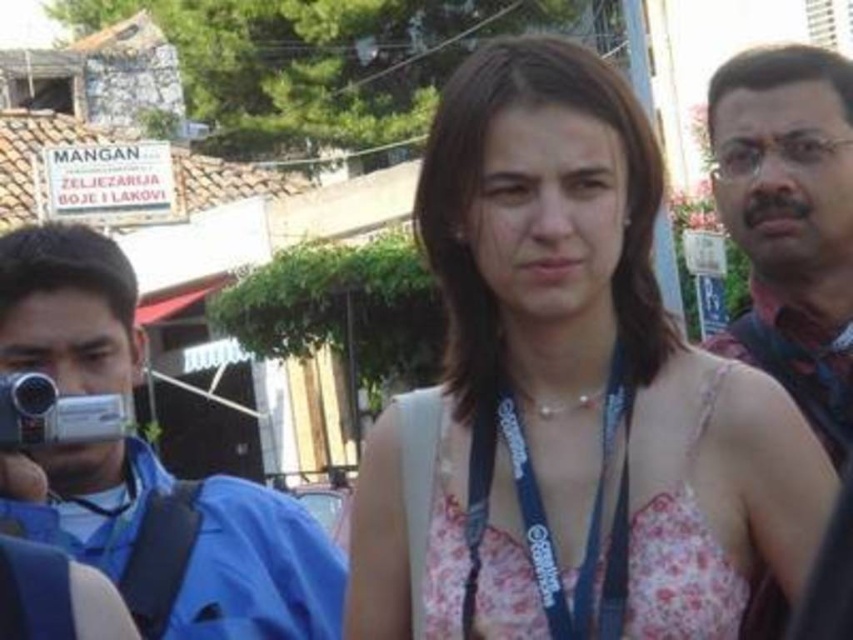
Question: Can you confirm if blue fabric lanyard at center is positioned above silver metallic camera at left?

Choices:
 (A) yes
 (B) no

Answer: (B)

Question: Observing the image, what is the correct spatial positioning of blue fabric camera at left in reference to blue fabric lanyard at center?

Choices:
 (A) left
 (B) right

Answer: (A)

Question: Which point is closer to the camera taking this photo?

Choices:
 (A) (584, 308)
 (B) (55, 266)
 (C) (27, 392)
 (D) (630, 401)

Answer: (D)

Question: Considering the relative positions of blue fabric lanyard at center and silver metallic camera at left in the image provided, where is blue fabric lanyard at center located with respect to silver metallic camera at left?

Choices:
 (A) above
 (B) below

Answer: (B)

Question: Based on their relative distances, which object is nearer to the blue fabric lanyard at center?

Choices:
 (A) blue fabric camera at left
 (B) white floral dress at center

Answer: (B)

Question: Among these points, which one is nearest to the camera?

Choices:
 (A) (824, 433)
 (B) (373, 435)
 (C) (531, 556)

Answer: (C)